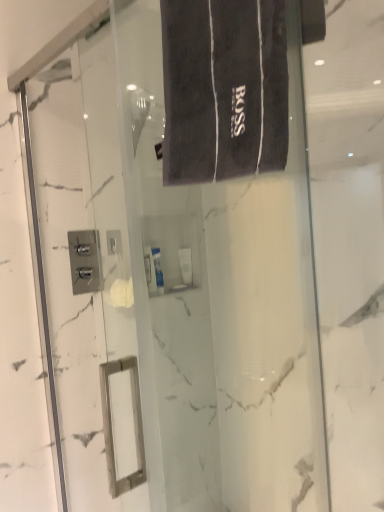
Question: Is the depth of white glossy tube at center, which is the 1th toiletry in back-to-front order, greater than that of dark gray terry cloth bath towel at upper center?

Choices:
 (A) yes
 (B) no

Answer: (A)

Question: Is white glossy tube at center, which is the 1th toiletry in back-to-front order, looking in the opposite direction of dark gray terry cloth bath towel at upper center?

Choices:
 (A) no
 (B) yes

Answer: (A)

Question: Is white glossy tube at center, which is the 1th toiletry in back-to-front order, placed right next to dark gray terry cloth bath towel at upper center?

Choices:
 (A) yes
 (B) no

Answer: (B)

Question: Is white glossy tube at center, marked as the second toiletry in a front-to-back arrangement, facing towards dark gray terry cloth bath towel at upper center?

Choices:
 (A) yes
 (B) no

Answer: (B)

Question: From a real-world perspective, is white glossy tube at center, marked as the second toiletry in a front-to-back arrangement, positioned over dark gray terry cloth bath towel at upper center based on gravity?

Choices:
 (A) yes
 (B) no

Answer: (B)

Question: Which is correct: dark gray terry cloth bath towel at upper center is inside white glossy tube at center, which is the 1th toiletry in back-to-front order, or outside of it?

Choices:
 (A) outside
 (B) inside

Answer: (A)

Question: Is dark gray terry cloth bath towel at upper center wider or thinner than white glossy tube at center, marked as the second toiletry in a front-to-back arrangement?

Choices:
 (A) wide
 (B) thin

Answer: (A)

Question: Is point (230, 124) positioned closer to the camera than point (155, 252)?

Choices:
 (A) closer
 (B) farther

Answer: (A)

Question: From a real-world perspective, is dark gray terry cloth bath towel at upper center positioned above or below white glossy tube at center, which is the 1th toiletry in back-to-front order?

Choices:
 (A) below
 (B) above

Answer: (B)

Question: Relative to white glossy tube at center, which is the 1th toiletry in back-to-front order, is white glossy tube at center, the first toiletry from the front, in front or behind?

Choices:
 (A) front
 (B) behind

Answer: (A)

Question: Considering the positions of white glossy tube at center, which ranks as the second toiletry in back-to-front order, and white glossy tube at center, which is the 1th toiletry in back-to-front order, in the image, is white glossy tube at center, which ranks as the second toiletry in back-to-front order, taller or shorter than white glossy tube at center, which is the 1th toiletry in back-to-front order,?

Choices:
 (A) tall
 (B) short

Answer: (A)

Question: Is point (145, 256) closer or farther from the camera than point (158, 278)?

Choices:
 (A) farther
 (B) closer

Answer: (B)

Question: Considering the relative positions of white glossy tube at center, which ranks as the second toiletry in back-to-front order, and white glossy tube at center, marked as the second toiletry in a front-to-back arrangement, in the image provided, is white glossy tube at center, which ranks as the second toiletry in back-to-front order, to the left or to the right of white glossy tube at center, marked as the second toiletry in a front-to-back arrangement,?

Choices:
 (A) left
 (B) right

Answer: (A)

Question: From the image's perspective, is dark gray terry cloth bath towel at upper center located above or below white glossy tube at center, the first toiletry from the front?

Choices:
 (A) above
 (B) below

Answer: (A)

Question: Is point (268, 126) closer or farther from the camera than point (152, 266)?

Choices:
 (A) closer
 (B) farther

Answer: (A)